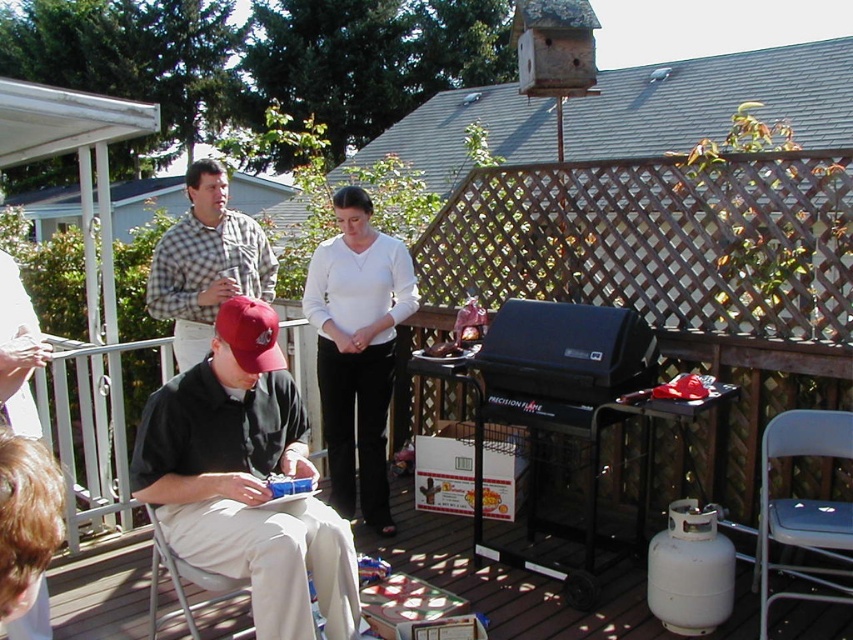
You are a person standing at the edge of the deck and want to move from the white plastic chair at lower left to the white smooth pants at center. Can you walk directly between them without needing to move any objects?

The distance between the white plastic chair at lower left and the white smooth pants at center is 32.96 inches, which is approximately 2.75 feet. Since this space is narrow but passable for a person, you can walk directly between them without needing to move any objects.

You are a photographer trying to capture a clear shot of the checkered fabric shirt at upper center and the white smooth pants at center. However, the scene is crowded. Based on their positions, which object is blocking the other?

The checkered fabric shirt at upper center is behind the white smooth pants at center, so the white smooth pants at center is blocking the checkered fabric shirt at upper center.